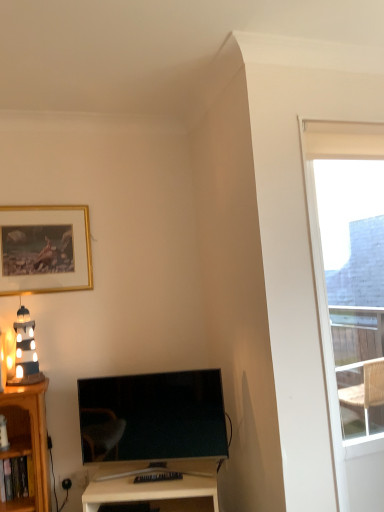
Question: From a real-world perspective, is matte black tv at lower center located higher than gold-framed picture at upper left?

Choices:
 (A) yes
 (B) no

Answer: (B)

Question: Is matte black tv at lower center located outside gold-framed picture at upper left?

Choices:
 (A) yes
 (B) no

Answer: (A)

Question: Does matte black tv at lower center appear on the right side of gold-framed picture at upper left?

Choices:
 (A) yes
 (B) no

Answer: (A)

Question: Can you confirm if matte black tv at lower center is positioned to the left of gold-framed picture at upper left?

Choices:
 (A) yes
 (B) no

Answer: (B)

Question: Is matte black tv at lower center positioned behind gold-framed picture at upper left?

Choices:
 (A) yes
 (B) no

Answer: (B)

Question: In terms of height, does matte black tv at lower center look taller or shorter compared to transparent glass window at upper right?

Choices:
 (A) short
 (B) tall

Answer: (A)

Question: Considering the positions of point (173, 417) and point (364, 140), is point (173, 417) closer or farther from the camera than point (364, 140)?

Choices:
 (A) farther
 (B) closer

Answer: (A)

Question: In the image, is matte black tv at lower center positioned in front of or behind transparent glass window at upper right?

Choices:
 (A) front
 (B) behind

Answer: (B)

Question: From the image's perspective, relative to transparent glass window at upper right, is matte black tv at lower center above or below?

Choices:
 (A) below
 (B) above

Answer: (A)

Question: In terms of height, does transparent glass window at upper right look taller or shorter compared to matte black tv at lower center?

Choices:
 (A) tall
 (B) short

Answer: (A)

Question: Is transparent glass window at upper right inside the boundaries of matte black tv at lower center, or outside?

Choices:
 (A) outside
 (B) inside

Answer: (A)

Question: Based on their sizes in the image, would you say transparent glass window at upper right is bigger or smaller than matte black tv at lower center?

Choices:
 (A) big
 (B) small

Answer: (A)

Question: Is transparent glass window at upper right to the left or to the right of matte black tv at lower center in the image?

Choices:
 (A) left
 (B) right

Answer: (B)

Question: In terms of height, does white glossy desk at center look taller or shorter compared to matte black lighthouse at left?

Choices:
 (A) tall
 (B) short

Answer: (B)

Question: Is white glossy desk at center bigger or smaller than matte black lighthouse at left?

Choices:
 (A) big
 (B) small

Answer: (A)